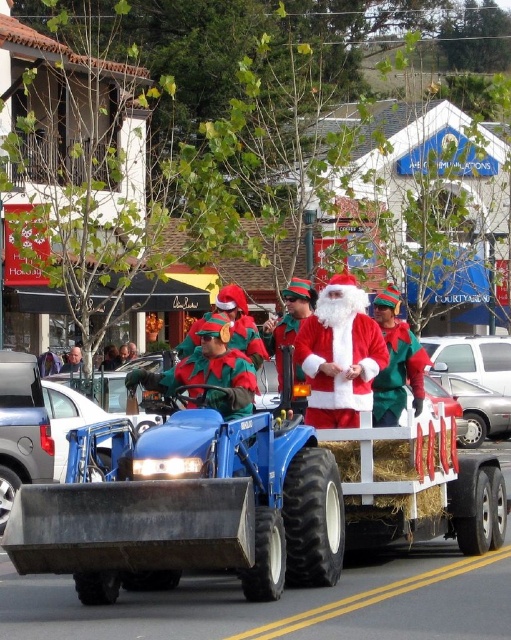
Question: Is green felt hat at center closer to camera compared to silver metallic car at center?

Choices:
 (A) no
 (B) yes

Answer: (B)

Question: Does fuzzy red santa at center have a larger size compared to green felt hat at center?

Choices:
 (A) yes
 (B) no

Answer: (A)

Question: Considering the real-world distances, which object is closest to the silver metallic car at center?

Choices:
 (A) green felt hat at center
 (B) white fluffy santa at center
 (C) fuzzy red santa at center
 (D) wooden hay at center

Answer: (B)

Question: Which point is farther from the camera taking this photo?

Choices:
 (A) (345, 339)
 (B) (92, 573)
 (C) (388, 310)
 (D) (313, 300)

Answer: (D)

Question: Which object is closer to the camera taking this photo?

Choices:
 (A) green felt hat at center
 (B) silver metallic car at center
 (C) silver metallic sedan at center
 (D) white fluffy santa at center

Answer: (D)

Question: Is fuzzy red santa at center positioned in front of white fluffy santa at center?

Choices:
 (A) yes
 (B) no

Answer: (B)